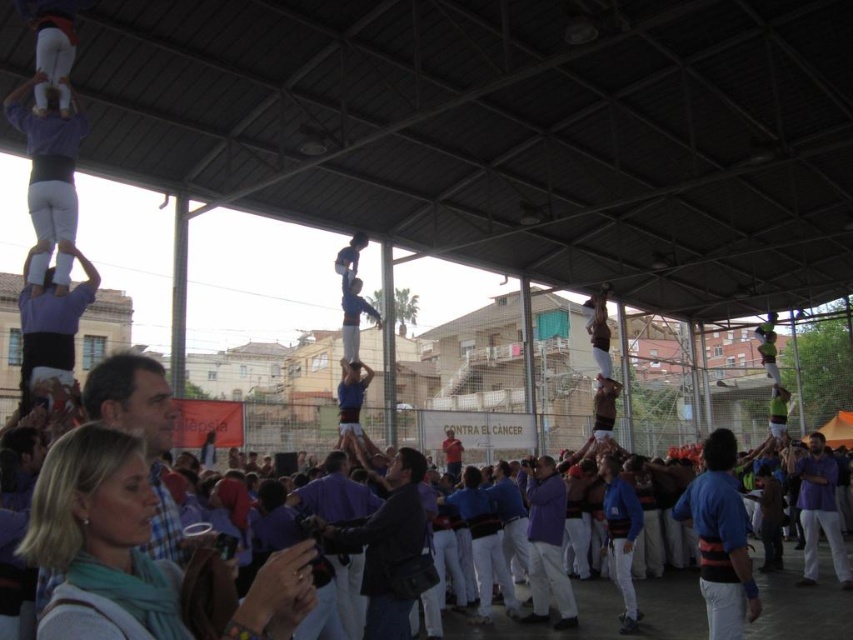
Question: Which point appears farthest from the camera in this image?

Choices:
 (A) pyautogui.click(x=601, y=326)
 (B) pyautogui.click(x=33, y=257)

Answer: (A)

Question: Is matte white pants at upper left to the left of white cotton shirt at center from the viewer's perspective?

Choices:
 (A) yes
 (B) no

Answer: (A)

Question: Where is matte white pants at upper left located in relation to white cotton shirt at center in the image?

Choices:
 (A) below
 (B) above

Answer: (B)

Question: Which point is farther to the camera?

Choices:
 (A) white cotton shirt at center
 (B) matte white pants at upper left

Answer: (A)

Question: Does matte white pants at upper left have a larger size compared to white cotton shirt at center?

Choices:
 (A) no
 (B) yes

Answer: (A)